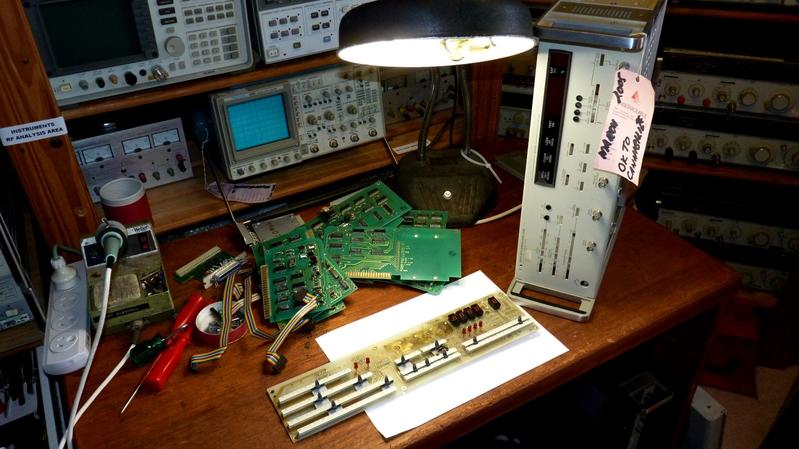
Image resolution: width=799 pixels, height=449 pixels. Find the location of `knobs`. knobs is located at coordinates (745, 100), (778, 105).